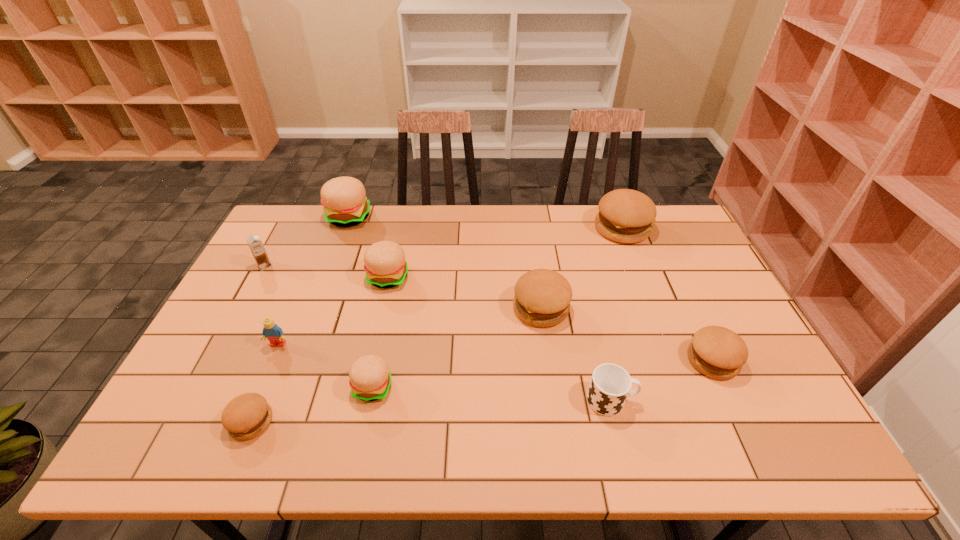
At what (x,y) coordinates should I click in order to perform the action: click on the smallest beige hamburger. Please return your answer as a coordinate pair (x, y). The image size is (960, 540). Looking at the image, I should click on (370, 379).

This screenshot has height=540, width=960. Find the location of `the shortest hamburger`. the shortest hamburger is located at coordinates (246, 416).

This screenshot has width=960, height=540. In order to click on the smallest brown hamburger in this screenshot , I will do `click(246, 416)`.

This screenshot has width=960, height=540. What are the coordinates of `free space located 0.320m on the front of the farthest beige hamburger` in the screenshot? It's located at (320, 295).

What are the coordinates of `vacant space located 0.060m on the left of the biggest brown hamburger` in the screenshot? It's located at (577, 228).

This screenshot has width=960, height=540. I want to click on free region located on the right of the leftmost object, so click(314, 266).

I want to click on vacant space located 0.100m on the right of the second nearest beige hamburger, so click(x=441, y=277).

I want to click on free region located on the front of the second biggest brown hamburger, so click(549, 369).

This screenshot has height=540, width=960. In order to click on vacant space located 0.290m on the face of the Lego in this screenshot , I will do `click(231, 456)`.

Find the location of `vacant region located on the front of the second smallest brown hamburger`. vacant region located on the front of the second smallest brown hamburger is located at coordinates (748, 435).